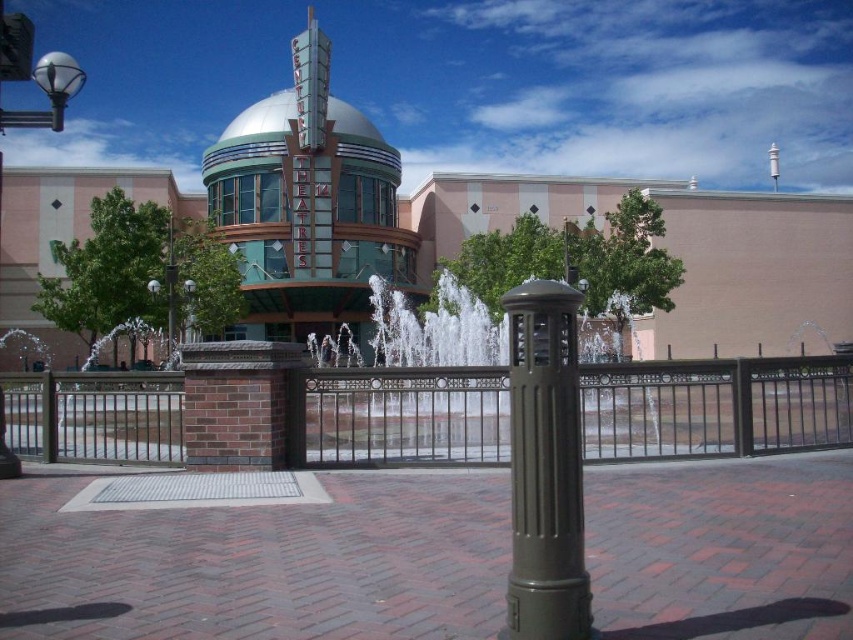
From the picture: Is brown metal fence at center positioned behind green matte pole at center?

Yes, brown metal fence at center is further from the viewer.

Is brown metal fence at center thinner than green matte pole at center?

No.

Image resolution: width=853 pixels, height=640 pixels. What do you see at coordinates (714, 406) in the screenshot? I see `brown metal fence at center` at bounding box center [714, 406].

At what (x,y) coordinates should I click in order to perform the action: click on brown metal fence at center. Please return your answer as a coordinate pair (x, y). The height and width of the screenshot is (640, 853). Looking at the image, I should click on (714, 406).

Can you confirm if metallic silver streetlight at upper left is smaller than polished silver lamp post at left?

No, metallic silver streetlight at upper left is not smaller than polished silver lamp post at left.

Is metallic silver streetlight at upper left below polished silver lamp post at left?

Incorrect, metallic silver streetlight at upper left is not positioned below polished silver lamp post at left.

Between point (33, 120) and point (169, 275), which one is positioned in front?

Positioned in front is point (33, 120).

Where is `metallic silver streetlight at upper left`? metallic silver streetlight at upper left is located at coordinates (48, 92).

Can you confirm if brown metal fence at center is thinner than green glass dome at center?

Yes.

Is point (502, 396) positioned after point (375, 156)?

No, (502, 396) is closer to viewer.

Between point (21, 404) and point (281, 125), which one is positioned behind?

The point (281, 125) is more distant.

At what (x,y) coordinates should I click in order to perform the action: click on brown metal fence at center. Please return your answer as a coordinate pair (x, y). This screenshot has height=640, width=853. Looking at the image, I should click on (714, 406).